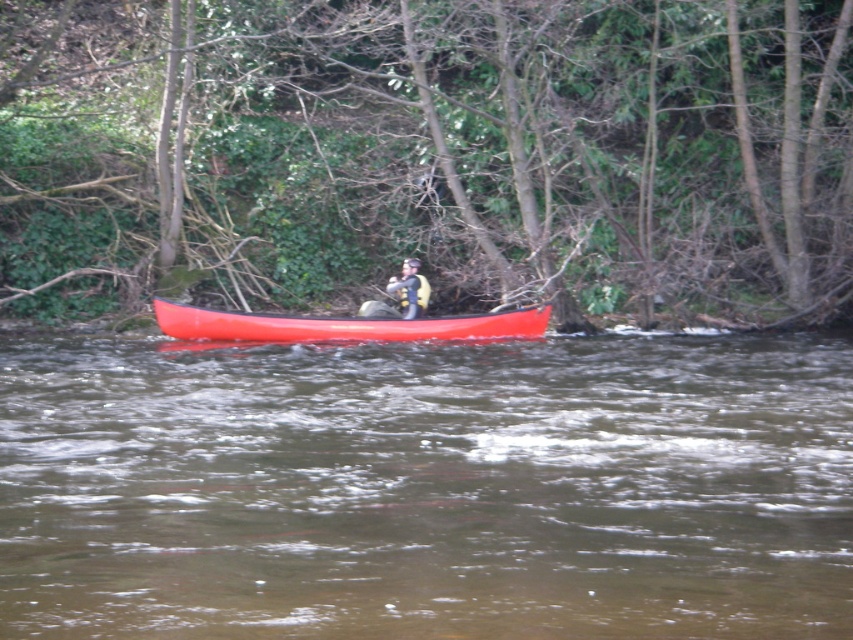
Can you confirm if green leafy tree at center is bigger than matte yellow life vest at center?

Indeed, green leafy tree at center has a larger size compared to matte yellow life vest at center.

Is green leafy tree at center smaller than matte yellow life vest at center?

No, green leafy tree at center is not smaller than matte yellow life vest at center.

Which is behind, point (664, 250) or point (404, 259)?

Point (404, 259)

Locate an element on the screen. green leafy tree at center is located at coordinates [x=428, y=154].

Can you confirm if green leafy tree at center is taller than brown murky water at center?

Yes, green leafy tree at center is taller than brown murky water at center.

Between green leafy tree at center and brown murky water at center, which one appears on the left side from the viewer's perspective?

Positioned to the left is green leafy tree at center.

Which is in front, point (708, 88) or point (6, 556)?

Point (6, 556) is more forward.

Find the location of `green leafy tree at center`. green leafy tree at center is located at coordinates (428, 154).

From the picture: Between brown murky water at center and matte red canoe at center, which one is positioned lower?

Positioned lower is brown murky water at center.

Is brown murky water at center below matte red canoe at center?

Yes, brown murky water at center is below matte red canoe at center.

The height and width of the screenshot is (640, 853). I want to click on brown murky water at center, so click(x=427, y=488).